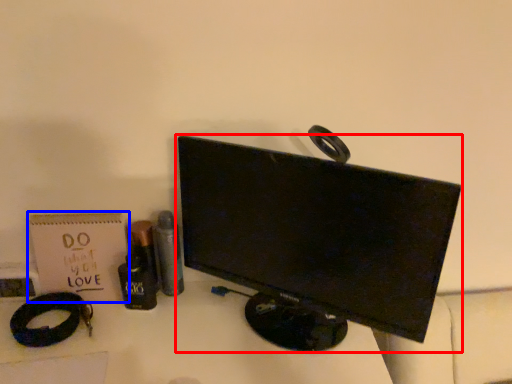
Question: Among these objects, which one is farthest to the camera, computer monitor (highlighted by a red box) or paperback book (highlighted by a blue box)?

Choices:
 (A) computer monitor
 (B) paperback book

Answer: (B)